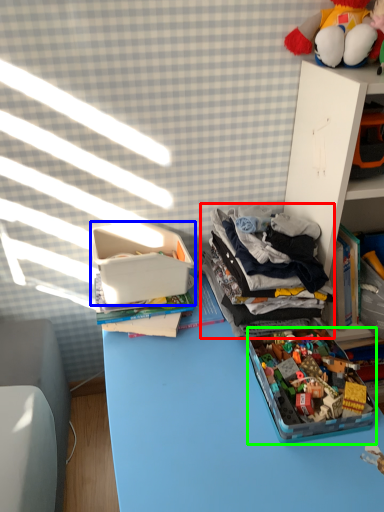
Question: Based on their relative distances, which object is farther from clothing (highlighted by a red box)? Choose from storage box (highlighted by a blue box) and toy (highlighted by a green box).

Choices:
 (A) storage box
 (B) toy

Answer: (A)